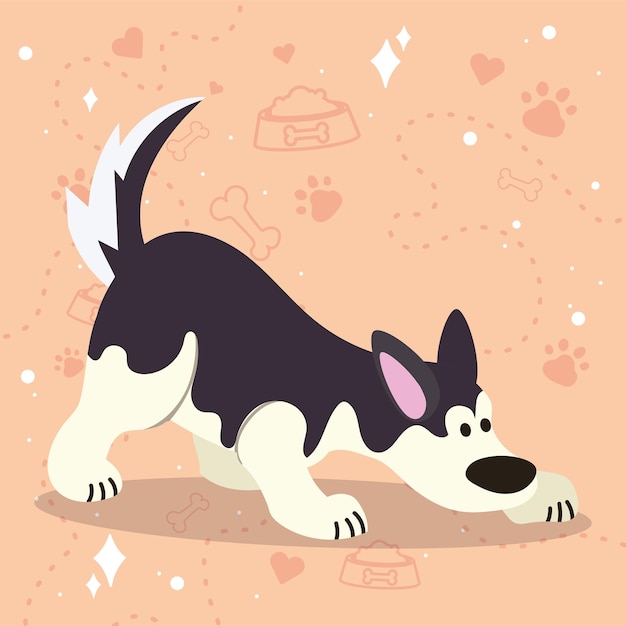
You are a GUI agent. You are given a task and a screenshot of the screen. Output one action in this format:
    pyautogui.click(x=<x>, y=<y>)
    Task: Click on the white fur
    The width and height of the screenshot is (626, 626).
    Given the screenshot: What is the action you would take?
    pyautogui.click(x=138, y=404), pyautogui.click(x=280, y=459), pyautogui.click(x=437, y=464), pyautogui.click(x=345, y=434), pyautogui.click(x=198, y=423), pyautogui.click(x=81, y=216)